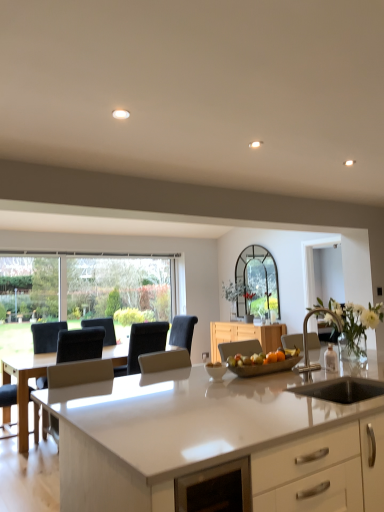
Question: Is satin silver armchair at center, which ranks as the 1th armchair in right-to-left order, to the left or to the right of metallic silver tray at center in the image?

Choices:
 (A) right
 (B) left

Answer: (A)

Question: Is satin silver armchair at center, which ranks as the 1th armchair in right-to-left order, in front of or behind metallic silver tray at center in the image?

Choices:
 (A) behind
 (B) front

Answer: (B)

Question: Which is farther from the white glossy countertop at center?

Choices:
 (A) white leather armchair at left, the 2th armchair in the front-to-back sequence
 (B) metallic silver tray at center
 (C) satin silver armchair at center, which is counted as the third armchair, starting from the back
 (D) black fabric armchair at center, which is the 1th armchair in back-to-front order
 (E) wooden cabinet at center

Answer: (E)

Question: Estimate the real-world distances between objects in this image. Which object is closer to the metallic silver tray at center?

Choices:
 (A) black fabric armchair at center, the 3th armchair when ordered from front to back
 (B) satin silver armchair at center, which ranks as the 1th armchair in right-to-left order
 (C) white glossy countertop at center
 (D) wooden cabinet at center
 (E) white leather armchair at left, the 2th armchair in the front-to-back sequence

Answer: (B)